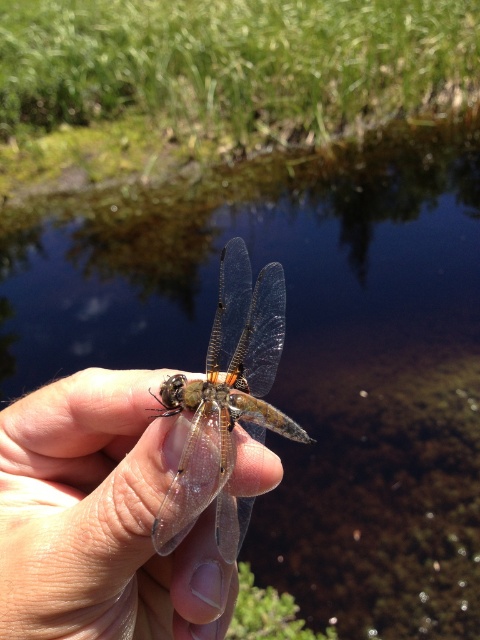
You are a photographer trying to capture the dragonfly in the scene. Based on their positions, which object is closer to the camera lens? The translucent skin at center or the transparent glass dragonfly at center?

The transparent glass dragonfly at center is closer to the camera lens because the translucent skin at center is below it, indicating it is positioned behind the dragonfly.

You are a jeweler examining a new piece of jewelry. You notice the translucent skin at center and the transparent glass dragonfly at center. Which object is bigger?

The translucent skin at center is bigger than the transparent glass dragonfly at center.